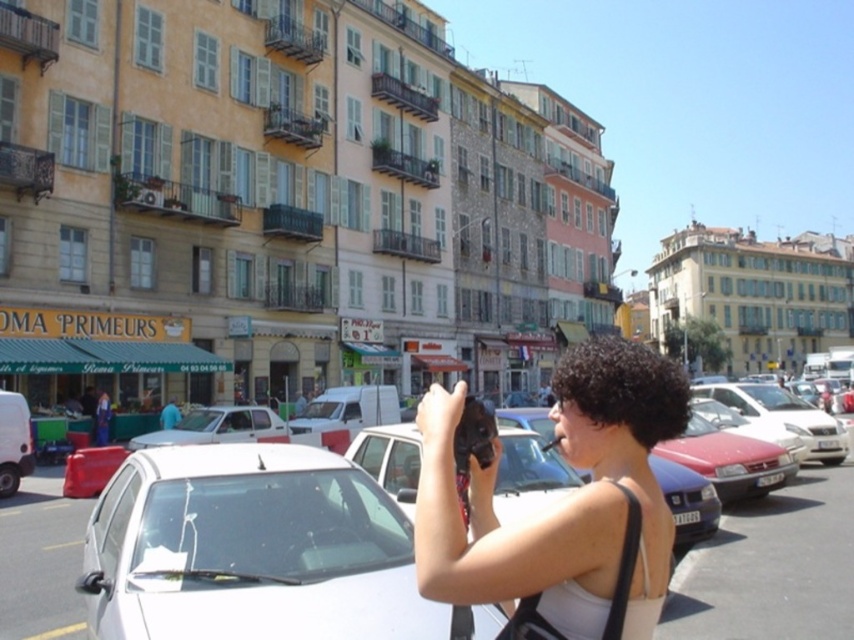
Question: Which point is closer to the camera?

Choices:
 (A) (528, 452)
 (B) (617, 364)

Answer: (B)

Question: Does white glossy car at lower left appear on the right side of white matte car at lower left?

Choices:
 (A) no
 (B) yes

Answer: (B)

Question: Which point is farther to the camera?

Choices:
 (A) white glossy car at lower left
 (B) white matte car at lower left
 (C) matte black camera at center
 (D) white glossy car at center

Answer: (B)

Question: Observing the image, what is the correct spatial positioning of white glossy car at center in reference to white glossy car at lower left?

Choices:
 (A) above
 (B) below

Answer: (A)

Question: Among these objects, which one is nearest to the camera?

Choices:
 (A) matte black camera at center
 (B) white glossy car at lower left
 (C) white matte car at lower left

Answer: (A)

Question: Is white glossy car at center to the right of white matte car at lower left from the viewer's perspective?

Choices:
 (A) no
 (B) yes

Answer: (B)